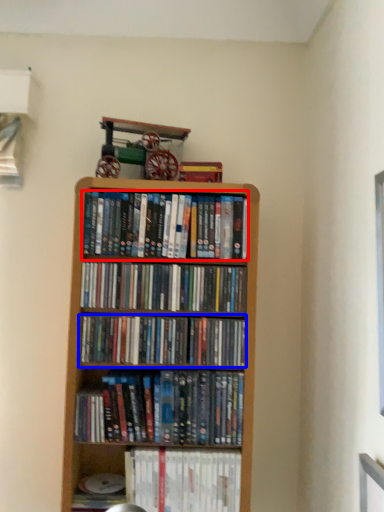
Question: Among these objects, which one is nearest to the camera, book (highlighted by a red box) or book (highlighted by a blue box)?

Choices:
 (A) book
 (B) book

Answer: (B)